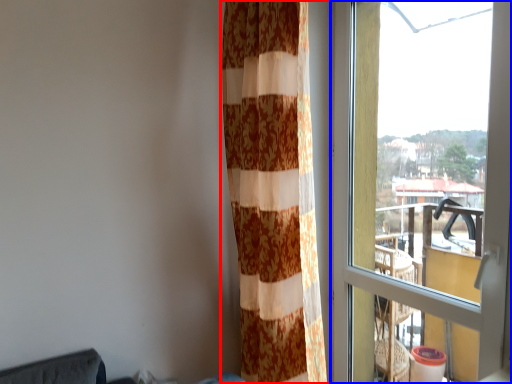
Question: Which object appears closest to the camera in this image, curtain (highlighted by a red box) or window (highlighted by a blue box)?

Choices:
 (A) curtain
 (B) window

Answer: (B)